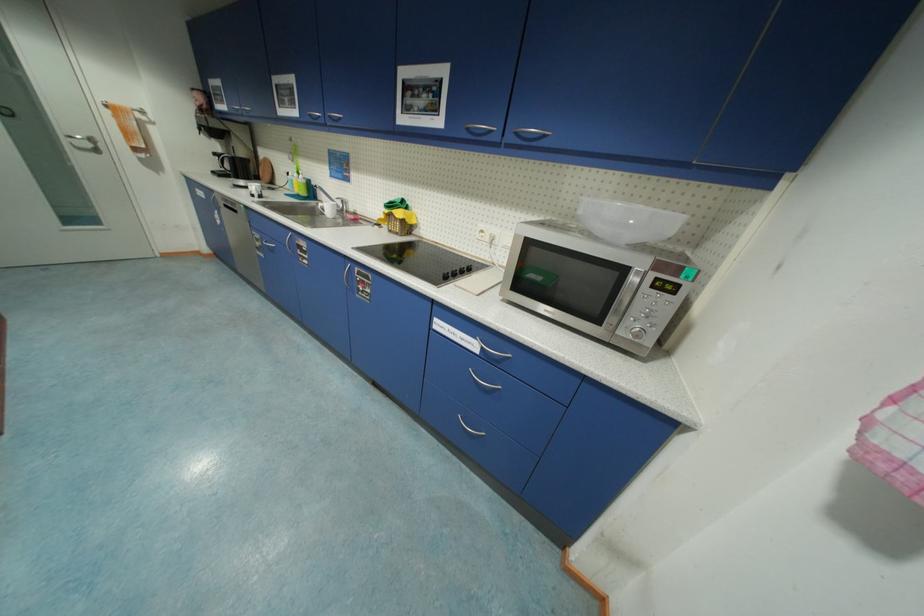
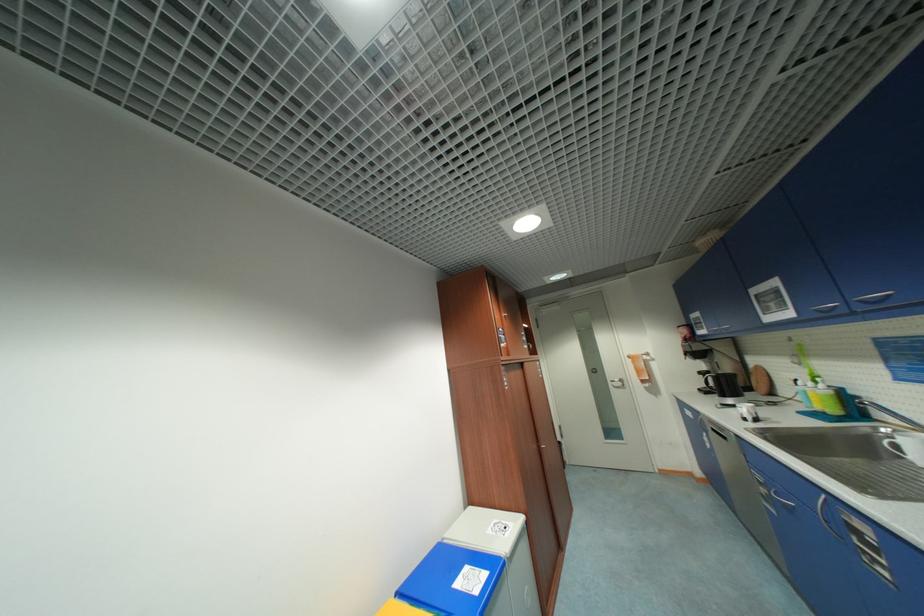
How did the camera likely rotate?

The camera rotated toward left-up.